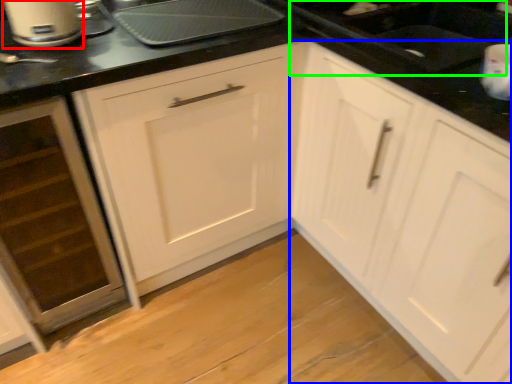
Question: Which object is the closest to the home appliance (highlighted by a red box)? Choose among these: cabinetry (highlighted by a blue box) or sink (highlighted by a green box).

Choices:
 (A) cabinetry
 (B) sink

Answer: (B)